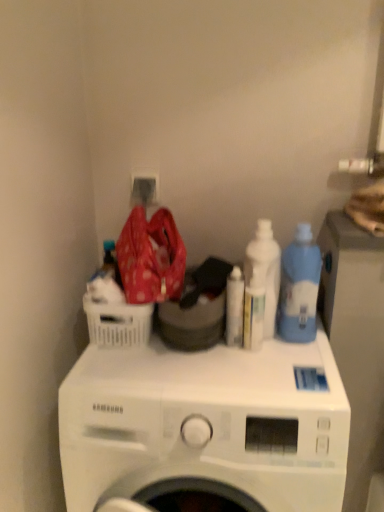
What are the coordinates of `unoccupied area in front of white glossy bottle at upper right, which appears as the second cleaning product when viewed from the right` in the screenshot? It's located at (268, 368).